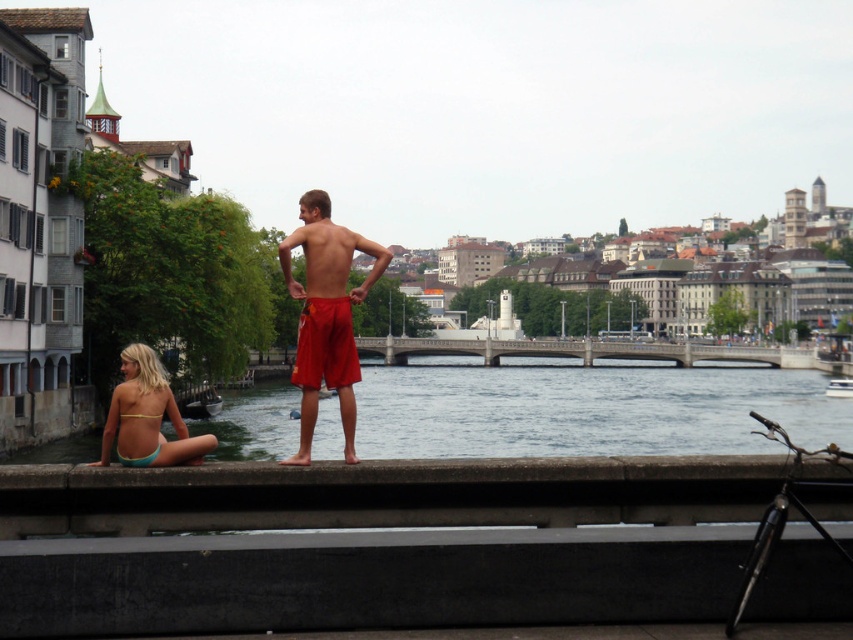
Question: Does matte red shorts at center appear over light blue bikini at lower left?

Choices:
 (A) yes
 (B) no

Answer: (A)

Question: Is matte red shorts at center to the right of light blue bikini at lower left from the viewer's perspective?

Choices:
 (A) no
 (B) yes

Answer: (B)

Question: Can you confirm if matte red shorts at center is smaller than light blue bikini at lower left?

Choices:
 (A) no
 (B) yes

Answer: (A)

Question: Which point is farther from the camera taking this photo?

Choices:
 (A) (141, 404)
 (B) (347, 422)

Answer: (B)